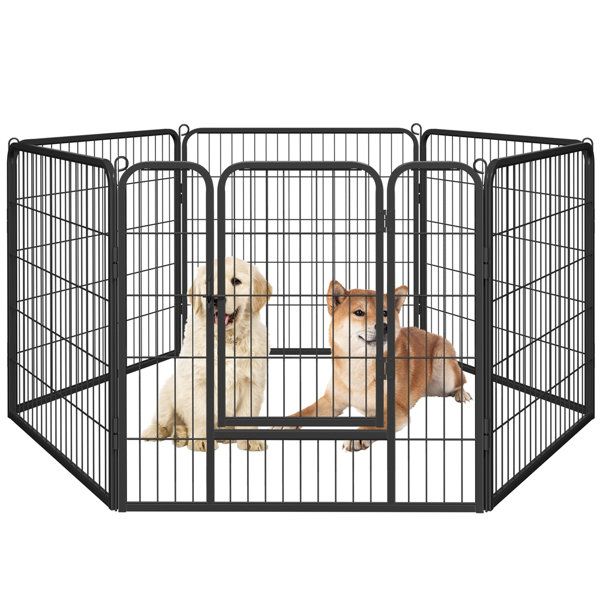
Where is `latch`? latch is located at coordinates pos(216,317).